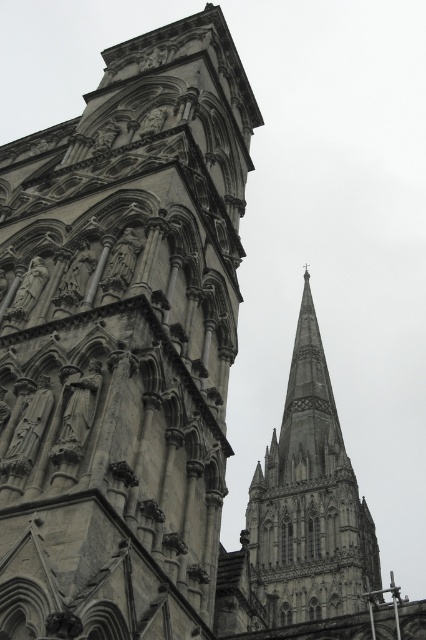
You are an architect examining the cathedral facade. You notice the stone carvings at center and the gray stone spire at upper center. Which of these two elements is taller?

The gray stone spire at upper center is taller than the stone carvings at center.

You are standing in front of the cathedral and want to take a closer look at both the stone carvings at center and the gray stone spire at upper center. Which one would you need to move towards first to get a better view of both?

You should first move towards the stone carvings at center since it is closer to you than the gray stone spire at upper center, allowing you to see it clearly before proceeding to the spire.